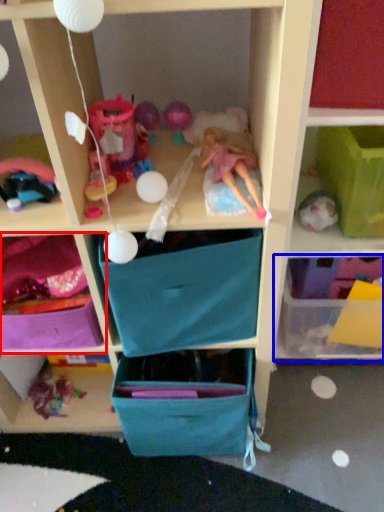
Question: Among these objects, which one is farthest to the camera, shelf (highlighted by a red box) or shelf (highlighted by a blue box)?

Choices:
 (A) shelf
 (B) shelf

Answer: (B)